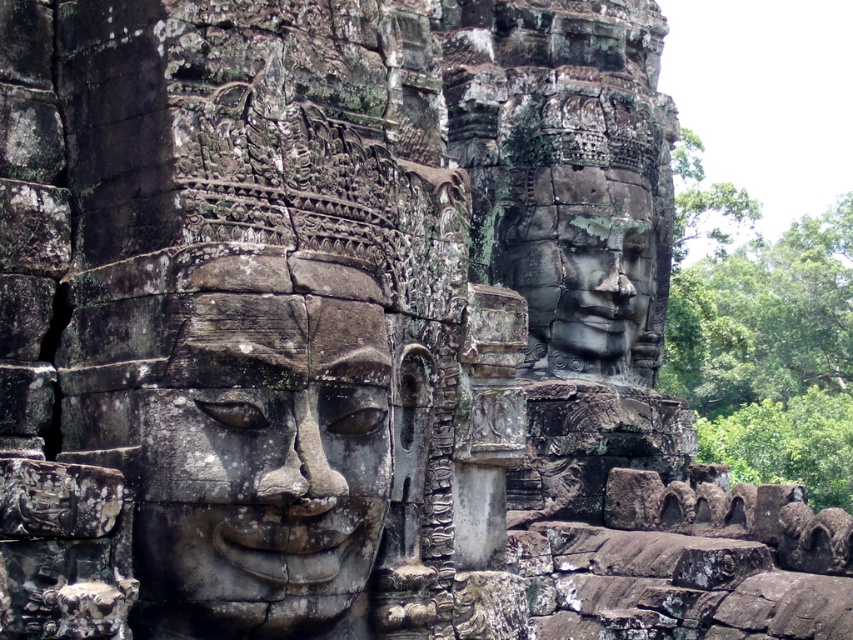
Question: Which of the following is the farthest from the observer?

Choices:
 (A) (193, 417)
 (B) (572, 221)

Answer: (B)

Question: Which of the following is the closest to the observer?

Choices:
 (A) pyautogui.click(x=375, y=321)
 (B) pyautogui.click(x=602, y=312)

Answer: (A)

Question: Which of the following is the closest to the observer?

Choices:
 (A) gray stone face at center
 (B) gray stone face at upper center

Answer: (A)

Question: Is gray stone face at center bigger than gray stone face at upper center?

Choices:
 (A) yes
 (B) no

Answer: (B)

Question: Does gray stone face at center appear over gray stone face at upper center?

Choices:
 (A) yes
 (B) no

Answer: (B)

Question: Does gray stone face at center have a smaller size compared to gray stone face at upper center?

Choices:
 (A) yes
 (B) no

Answer: (A)